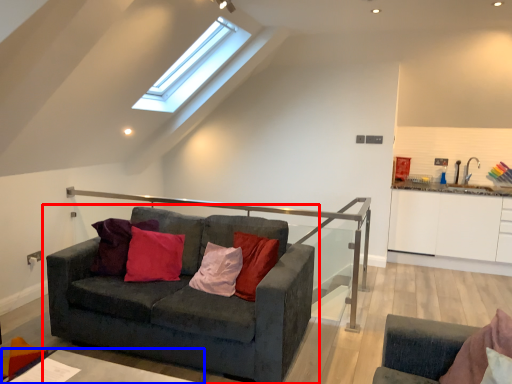
Question: Which object is closer to the camera taking this photo, studio couch (highlighted by a red box) or table (highlighted by a blue box)?

Choices:
 (A) studio couch
 (B) table

Answer: (B)